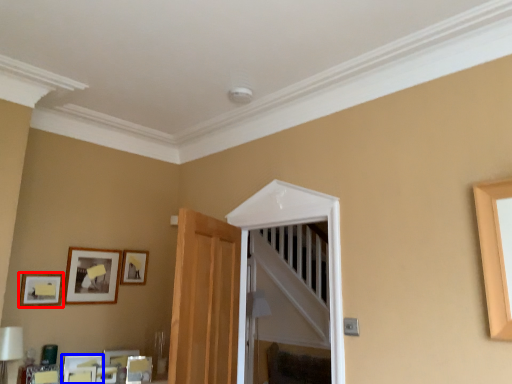
Question: Which object is closer to the camera taking this photo, picture frame (highlighted by a red box) or picture frame (highlighted by a blue box)?

Choices:
 (A) picture frame
 (B) picture frame

Answer: (A)